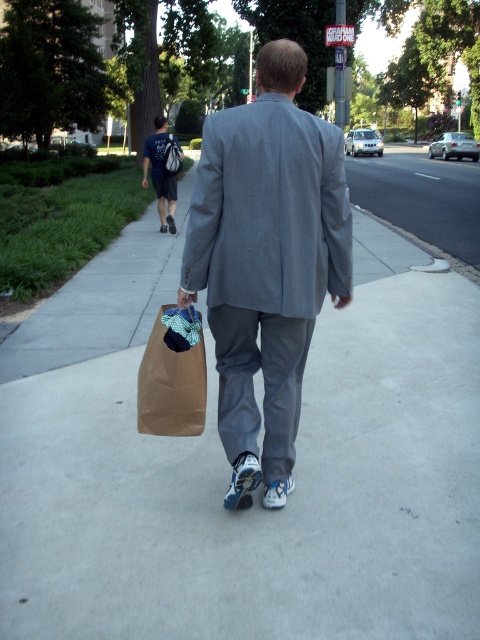
Does gray wool suit at center have a larger size compared to brown paper bag at center?

Yes, gray wool suit at center is bigger than brown paper bag at center.

Is point (229, 304) farther from viewer compared to point (189, 369)?

No, it is in front of (189, 369).

Who is more distant from viewer, (269,120) or (189,426)?

Positioned behind is point (189,426).

The image size is (480, 640). What are the coordinates of `gray wool suit at center` in the screenshot? It's located at (266, 260).

Can you confirm if brown paper bag at center is wider than dark blue t-shirt at upper left?

No, brown paper bag at center is not wider than dark blue t-shirt at upper left.

Does brown paper bag at center lie in front of dark blue t-shirt at upper left?

Yes.

Between point (189, 396) and point (171, 189), which one is positioned behind?

Positioned behind is point (171, 189).

Where is `brown paper bag at center`? brown paper bag at center is located at coordinates (170, 387).

Between gray wool suit at center and dark blue t-shirt at upper left, which one is positioned higher?

dark blue t-shirt at upper left

Find the location of a particular element. Image resolution: width=480 pixels, height=640 pixels. gray wool suit at center is located at coordinates (266, 260).

Who is more distant from viewer, (264,200) or (160,140)?

Point (160,140)

Find the location of a particular element. gray wool suit at center is located at coordinates point(266,260).